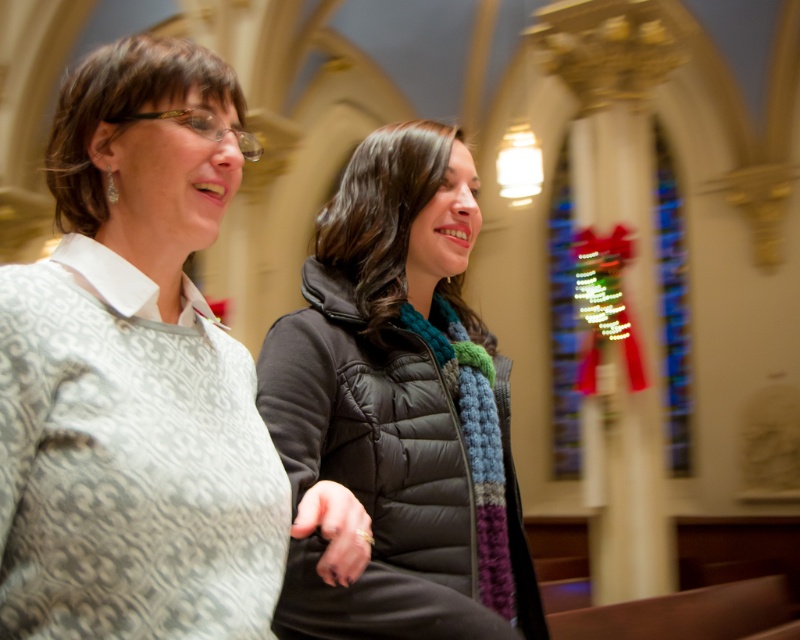
Question: From the image, what is the correct spatial relationship of patterned fabric shirt at left in relation to black quilted jacket at center?

Choices:
 (A) below
 (B) above

Answer: (B)

Question: Is patterned fabric shirt at left below black quilted jacket at center?

Choices:
 (A) yes
 (B) no

Answer: (B)

Question: Which point appears farthest from the camera in this image?

Choices:
 (A) (264, 349)
 (B) (196, 451)

Answer: (A)

Question: Can you confirm if patterned fabric shirt at left is bigger than black quilted jacket at center?

Choices:
 (A) no
 (B) yes

Answer: (A)

Question: Which point appears closest to the camera in this image?

Choices:
 (A) (428, 163)
 (B) (220, 435)

Answer: (B)